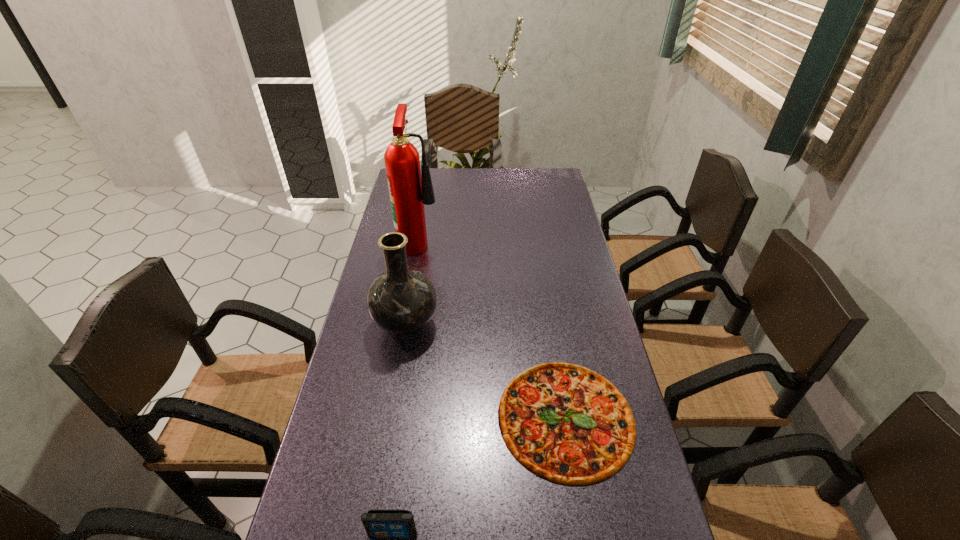
You are a GUI agent. You are given a task and a screenshot of the screen. Output one action in this format:
    pyautogui.click(x=<x>, y=<y>)
    Task: Click on the free spot located on the back of the rightmost object
    The width and height of the screenshot is (960, 540).
    Given the screenshot: What is the action you would take?
    pyautogui.click(x=552, y=335)

Locate an element on the screen. This screenshot has width=960, height=540. fire extinguisher that is positioned at the left edge is located at coordinates (410, 186).

The image size is (960, 540). I want to click on vase present at the left edge, so click(x=401, y=301).

Image resolution: width=960 pixels, height=540 pixels. Find the location of `iPod that is at the left edge`. iPod that is at the left edge is located at coordinates (379, 524).

Locate an element on the screen. object that is at the right edge is located at coordinates (566, 423).

Find the location of a particular element. free space at the far edge of the desktop is located at coordinates (446, 191).

This screenshot has width=960, height=540. Find the location of `free spot at the left edge of the desktop`. free spot at the left edge of the desktop is located at coordinates (334, 521).

At what (x,y) coordinates should I click in order to perform the action: click on vacant space at the right edge of the desktop. Please return your answer as a coordinate pair (x, y). Looking at the image, I should click on (550, 270).

You are a GUI agent. You are given a task and a screenshot of the screen. Output one action in this format:
    pyautogui.click(x=<x>, y=<y>)
    Task: Click on the free point between the shortest object and the third shortest object
    
    Given the screenshot: What is the action you would take?
    pyautogui.click(x=486, y=370)

The width and height of the screenshot is (960, 540). I want to click on vacant region between the second shortest object and the third nearest object, so click(399, 429).